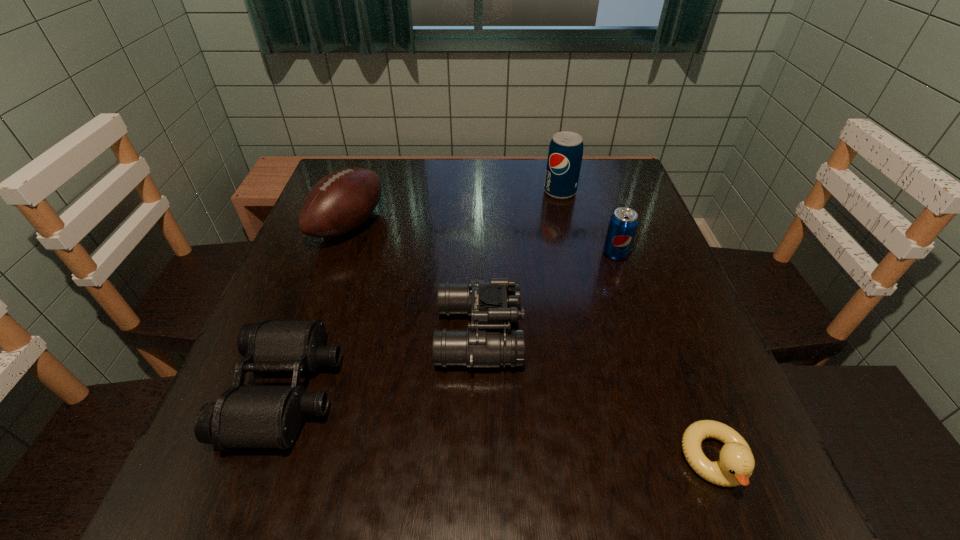
Locate an element on the screen. This screenshot has width=960, height=540. vacant space that is in between the duckling and the nearer pop soda is located at coordinates (665, 357).

Locate an element on the screen. The width and height of the screenshot is (960, 540). free space between the right pop soda and the shorter binoculars is located at coordinates (450, 322).

Identify which object is the nearest to the duckling. Please provide its 2D coordinates. Your answer should be formatted as a tuple, i.e. [(x, y)], where the tuple contains the x and y coordinates of a point satisfying the conditions above.

[(492, 304)]

Choose which object is the fourth nearest neighbor to the football (American). Please provide its 2D coordinates. Your answer should be formatted as a tuple, i.e. [(x, y)], where the tuple contains the x and y coordinates of a point satisfying the conditions above.

[(623, 223)]

Locate an element on the screen. This screenshot has width=960, height=540. vacant space that satisfies the following two spatial constraints: 1. on the back side of the football (American); 2. on the left side of the left pop soda is located at coordinates (360, 192).